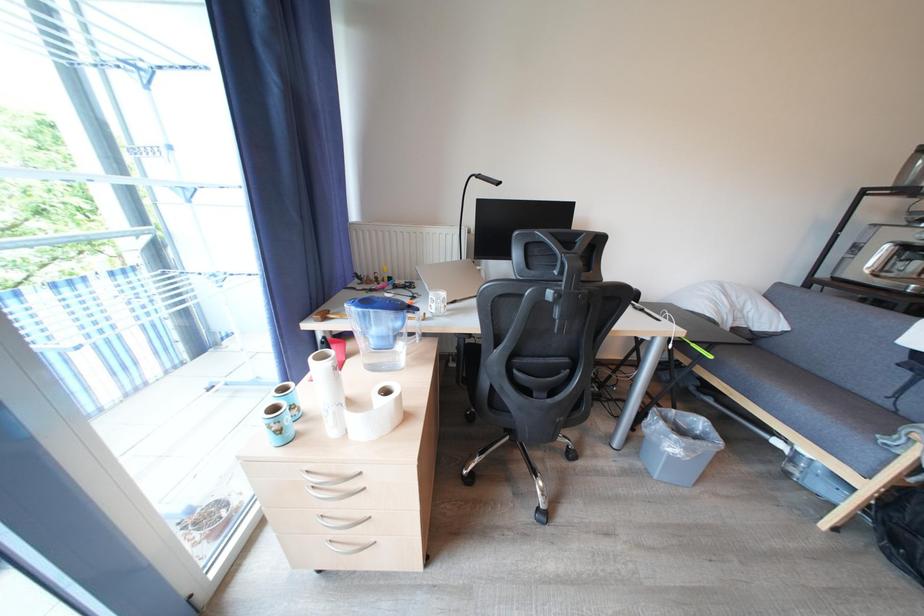
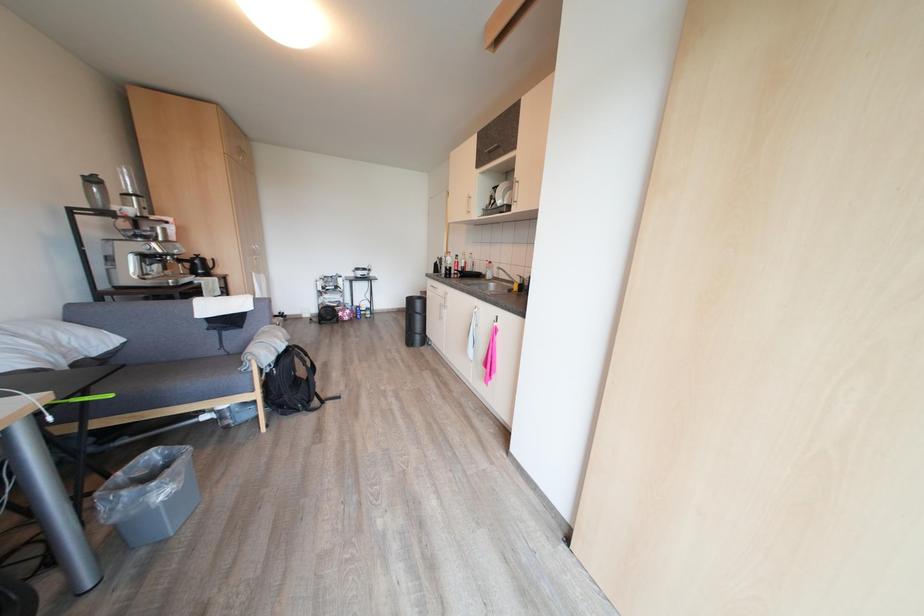
The first image is from the beginning of the video and the second image is from the end. How did the camera likely rotate when shooting the video?

The camera rotated toward right-down.